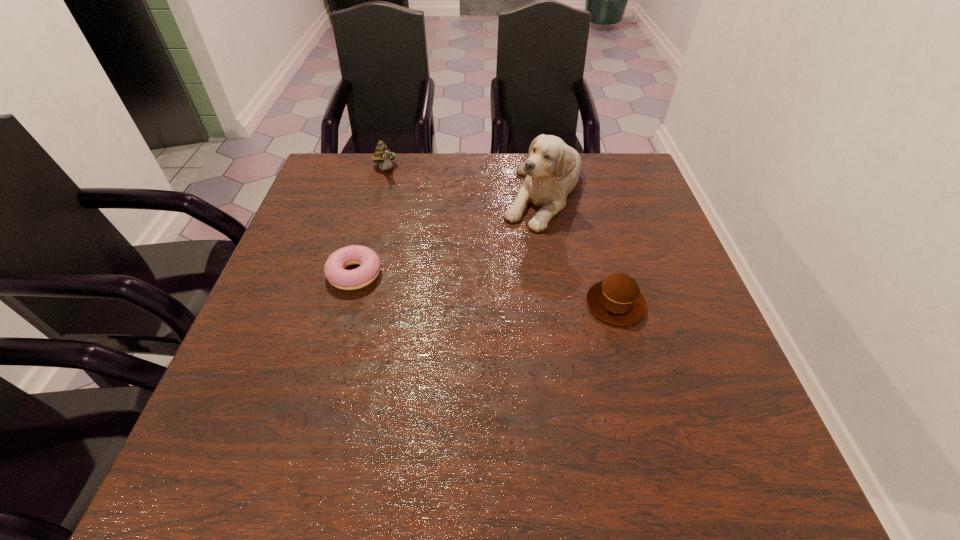
Where is `the shortest object`? the shortest object is located at coordinates (334, 269).

What are the coordinates of `the third tallest object` in the screenshot? It's located at (617, 300).

Find the location of `the tallest object`. the tallest object is located at coordinates point(552,169).

Find the location of a particular element. The width and height of the screenshot is (960, 540). snail is located at coordinates (383, 155).

Where is `vacant space situated on the back of the shortest object`? The image size is (960, 540). vacant space situated on the back of the shortest object is located at coordinates (375, 200).

In order to click on vacant region located 0.140m on the front of the third tallest object in this screenshot , I will do `click(639, 388)`.

Image resolution: width=960 pixels, height=540 pixels. What are the coordinates of `free space located 0.050m on the front-facing side of the puppy` in the screenshot? It's located at (533, 245).

Identify the location of vacant position located 0.260m on the front-facing side of the puppy. The width and height of the screenshot is (960, 540). (513, 308).

The width and height of the screenshot is (960, 540). What are the coordinates of `free spot located 0.300m on the front-facing side of the puppy` in the screenshot? It's located at (509, 322).

This screenshot has width=960, height=540. I want to click on free location located on the face of the third shortest object, so click(428, 262).